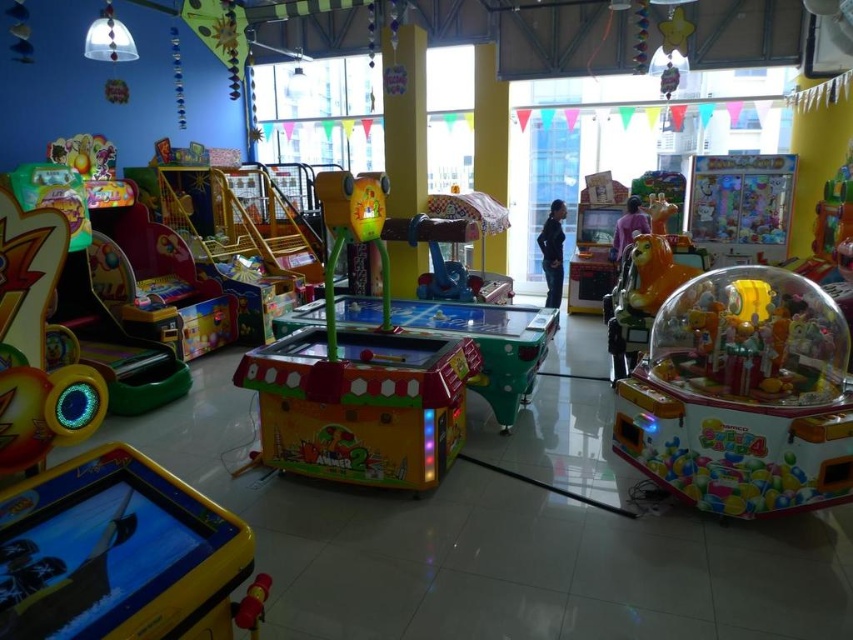
Does translucent plastic claw machine at right have a larger size compared to purple matte jacket at center?

Indeed, translucent plastic claw machine at right has a larger size compared to purple matte jacket at center.

Which is behind, point (741, 369) or point (625, 225)?

Positioned behind is point (625, 225).

The height and width of the screenshot is (640, 853). In order to click on translucent plastic claw machine at right in this screenshot , I will do `click(741, 396)`.

Can you confirm if translucent plastic claw machine at right is wider than yellow plastic pirate ship at lower left?

Indeed, translucent plastic claw machine at right has a greater width compared to yellow plastic pirate ship at lower left.

Can you confirm if translucent plastic claw machine at right is positioned to the right of yellow plastic pirate ship at lower left?

Indeed, translucent plastic claw machine at right is positioned on the right side of yellow plastic pirate ship at lower left.

Is point (833, 324) positioned after point (97, 582)?

Yes.

At what (x,y) coordinates should I click in order to perform the action: click on translucent plastic claw machine at right. Please return your answer as a coordinate pair (x, y). Looking at the image, I should click on (741, 396).

Who is higher up, yellow plastic pirate ship at lower left or matte yellow plastic game at center?

matte yellow plastic game at center is higher up.

Is point (231, 563) farther from camera compared to point (384, 480)?

No, (231, 563) is closer to viewer.

Who is more forward, [3,579] or [341,476]?

Point [3,579] is more forward.

The image size is (853, 640). I want to click on yellow plastic pirate ship at lower left, so click(x=120, y=554).